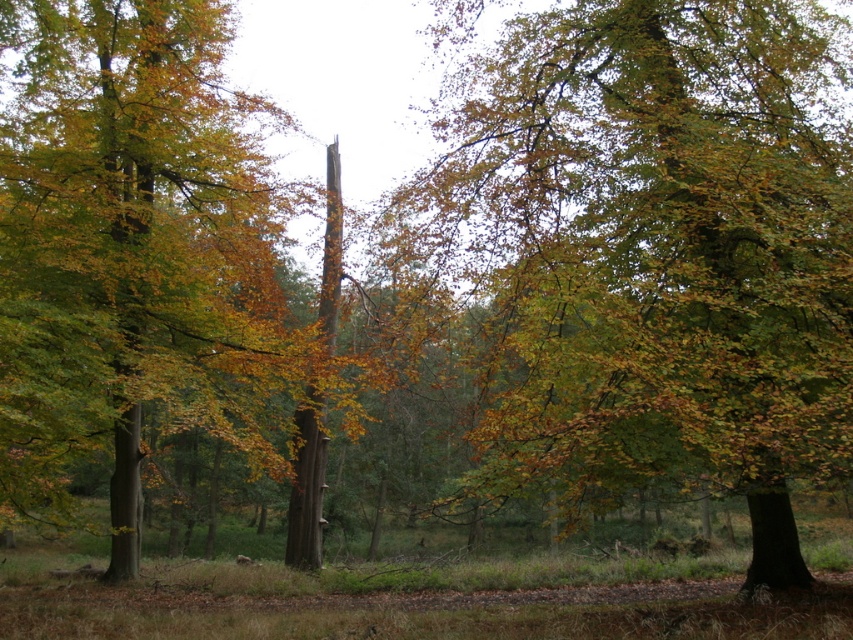
You are a bird looking for a nesting spot. You see the green leafy tree at center and the green leafy tree at left. Which tree would provide more space for your nest?

The green leafy tree at center has a larger size compared to the green leafy tree at left, so it would provide more space for your nest.

You are standing in the forest and want to take a photo of the green leafy tree at center. If your camera can focus on objects up to 10 meters away, will you be able to capture a clear image of the tree?

The green leafy tree at center is 8.82 meters away from the camera, which is within the camera focus range of up to 10 meters. Therefore, you can capture a clear image of the tree.

You are a hiker in the forest and see the point marked at coordinates (656, 253). What object does this point correspond to in the scene?

The point at coordinates (656, 253) corresponds to the green leafy tree at center.